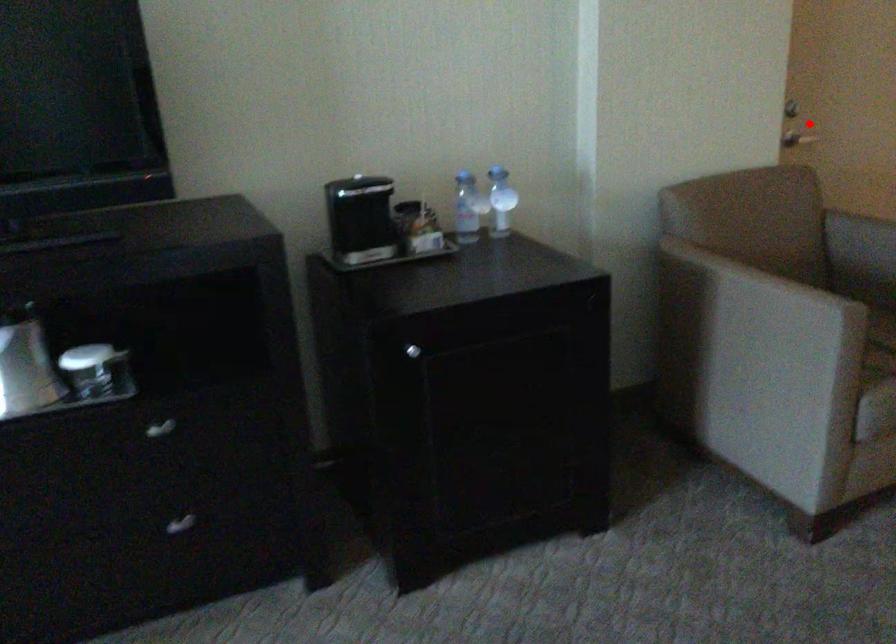
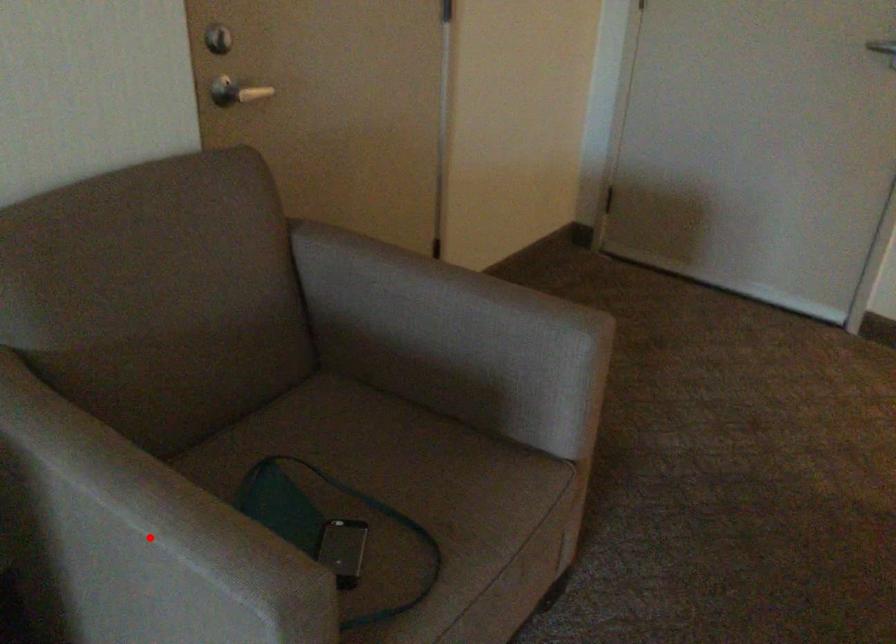
I am providing you with two images of the same scene from different viewpoints. A red point is marked on the first image and another point is marked on the second image. Is the red point in image1 aligned with the point shown in image2?

No